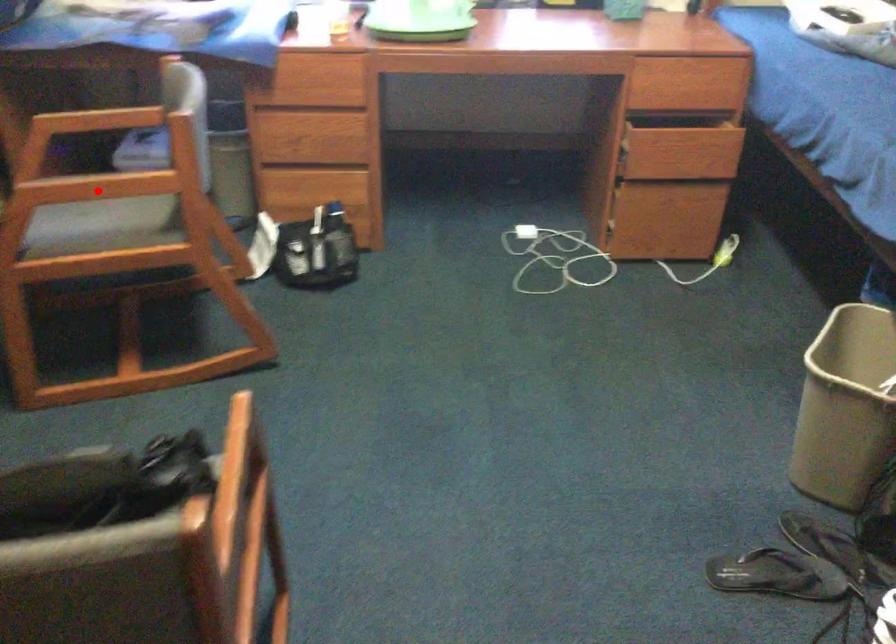
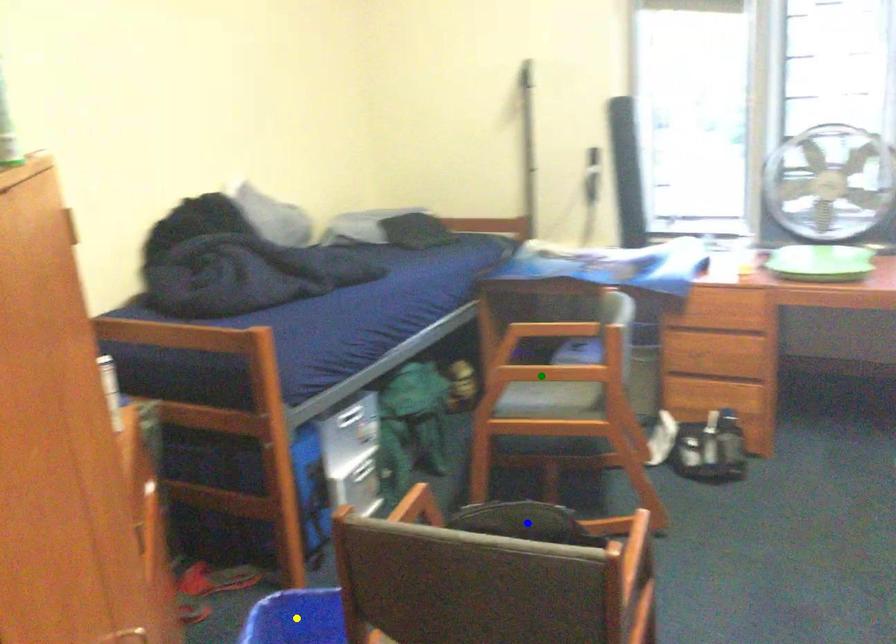
Question: I am providing you with two images of the same scene from different viewpoints. A red point is marked on the first image. You are given multiple points on the second image. Which point in image 2 is actually the same real-world point as the red point in image 1?

Choices:
 (A) blue point
 (B) green point
 (C) yellow point

Answer: (B)